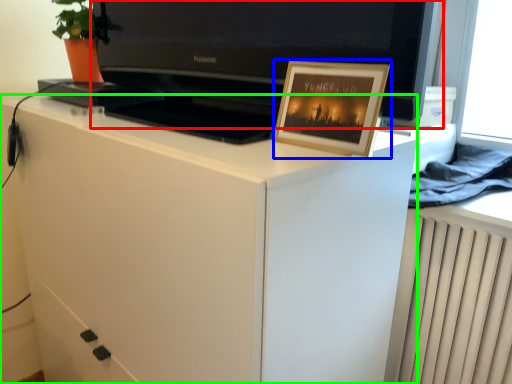
Question: Which object is the farthest from television (highlighted by a red box)? Choose among these: picture frame (highlighted by a blue box) or cabinetry (highlighted by a green box).

Choices:
 (A) picture frame
 (B) cabinetry

Answer: (B)